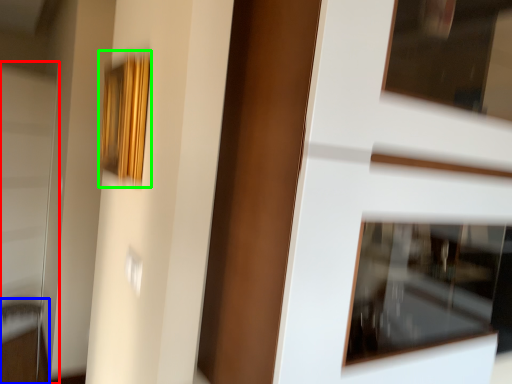
Question: Considering the real-world distances, which object is closest to screen door (highlighted by a red box)? furniture (highlighted by a blue box) or picture frame (highlighted by a green box).

Choices:
 (A) furniture
 (B) picture frame

Answer: (A)